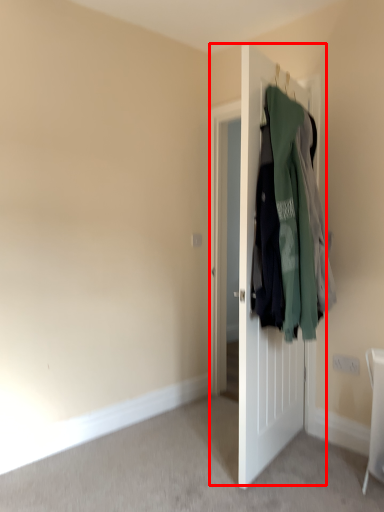
Question: In this image, where is door (annotated by the red box) located relative to laundry?

Choices:
 (A) left
 (B) right

Answer: (A)